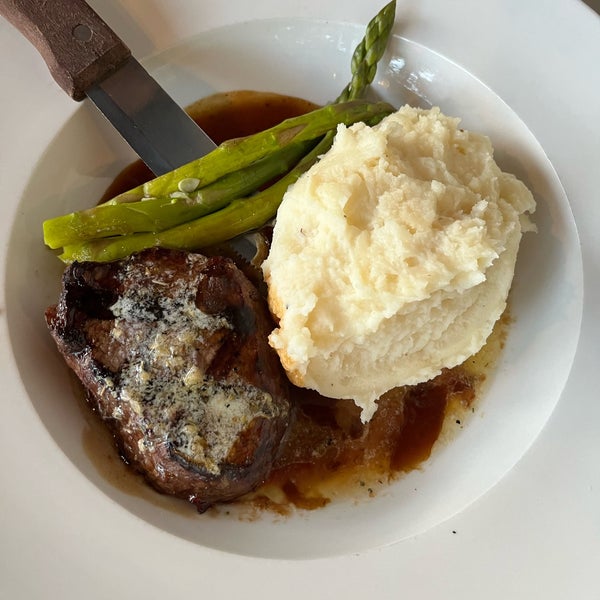
The width and height of the screenshot is (600, 600). Identify the location of white background, countertop. (29, 80).